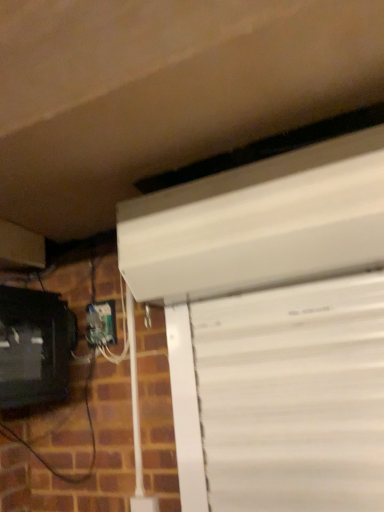
You are a GUI agent. You are given a task and a screenshot of the screen. Output one action in this format:
    pyautogui.click(x=<x>, y=<y>)
    Task: Click on the matte black monitor at lower left
    
    Given the screenshot: What is the action you would take?
    pyautogui.click(x=34, y=347)

What is the approximate height of matte black monitor at lower left?

matte black monitor at lower left is 37.65 centimeters tall.

The width and height of the screenshot is (384, 512). Describe the element at coordinates (34, 347) in the screenshot. I see `matte black monitor at lower left` at that location.

What do you see at coordinates (101, 324) in the screenshot? I see `white plastic electric outlet at lower left` at bounding box center [101, 324].

You are a GUI agent. You are given a task and a screenshot of the screen. Output one action in this format:
    pyautogui.click(x=<x>, y=<y>)
    Task: Click on the white plastic electric outlet at lower left
    
    Given the screenshot: What is the action you would take?
    pyautogui.click(x=101, y=324)

Locate an element on the screen. The width and height of the screenshot is (384, 512). matte black monitor at lower left is located at coordinates (34, 347).

Which object is positioned more to the left, white plastic electric outlet at lower left or matte black monitor at lower left?

matte black monitor at lower left is more to the left.

Is white plastic electric outlet at lower left positioned behind matte black monitor at lower left?

Yes, it is.

Considering the positions of point (87, 323) and point (35, 342), is point (87, 323) closer or farther from the camera than point (35, 342)?

Point (87, 323) is closer to the camera than point (35, 342).

Consider the image. From the image's perspective, who appears lower, white plastic electric outlet at lower left or matte black monitor at lower left?

matte black monitor at lower left appears lower in the image.

From a real-world perspective, is white plastic electric outlet at lower left positioned over matte black monitor at lower left based on gravity?

Yes, from a real-world perspective, white plastic electric outlet at lower left is over matte black monitor at lower left

Based on the photo, considering the relative sizes of white plastic electric outlet at lower left and matte black monitor at lower left in the image provided, is white plastic electric outlet at lower left thinner than matte black monitor at lower left?

Yes, white plastic electric outlet at lower left is thinner than matte black monitor at lower left.

Does white plastic electric outlet at lower left have a greater height compared to matte black monitor at lower left?

No, white plastic electric outlet at lower left is not taller than matte black monitor at lower left.

Which of these two, white plastic electric outlet at lower left or matte black monitor at lower left, is bigger?

Bigger between the two is matte black monitor at lower left.

Is white plastic electric outlet at lower left outside of matte black monitor at lower left?

Yes, white plastic electric outlet at lower left is not within matte black monitor at lower left.

Would you consider white plastic electric outlet at lower left to be distant from matte black monitor at lower left?

Actually, white plastic electric outlet at lower left and matte black monitor at lower left are a little close together.

Could you tell me if white plastic electric outlet at lower left is turned towards matte black monitor at lower left?

Yes, white plastic electric outlet at lower left is turned towards matte black monitor at lower left.

In the scene shown: Could you measure the distance between white plastic electric outlet at lower left and matte black monitor at lower left?

white plastic electric outlet at lower left is 8.93 inches away from matte black monitor at lower left.

Image resolution: width=384 pixels, height=512 pixels. What are the coordinates of `electric outlet above the matte black monitor at lower left (from the image's perspective)` in the screenshot? It's located at (101, 324).

Considering the relative positions of matte black monitor at lower left and white plastic electric outlet at lower left in the image provided, is matte black monitor at lower left to the left or to the right of white plastic electric outlet at lower left?

Clearly, matte black monitor at lower left is on the left of white plastic electric outlet at lower left in the image.

Who is more distant, matte black monitor at lower left or white plastic electric outlet at lower left?

white plastic electric outlet at lower left is more distant.

Is point (52, 379) more distant than point (113, 309)?

Yes, it is behind point (113, 309).

From the image's perspective, which is below, matte black monitor at lower left or white plastic electric outlet at lower left?

matte black monitor at lower left, from the image's perspective.

From a real-world perspective, is matte black monitor at lower left over white plastic electric outlet at lower left?

No, from a real-world perspective, matte black monitor at lower left is not above white plastic electric outlet at lower left.

Which object is wider, matte black monitor at lower left or white plastic electric outlet at lower left?

Wider between the two is matte black monitor at lower left.

Considering the sizes of matte black monitor at lower left and white plastic electric outlet at lower left in the image, is matte black monitor at lower left taller or shorter than white plastic electric outlet at lower left?

Considering their sizes, matte black monitor at lower left has more height than white plastic electric outlet at lower left.

Which of these two, matte black monitor at lower left or white plastic electric outlet at lower left, is bigger?

Bigger between the two is matte black monitor at lower left.

Is matte black monitor at lower left positioned beyond the bounds of white plastic electric outlet at lower left?

Yes, matte black monitor at lower left is not within white plastic electric outlet at lower left.

From the picture: Is matte black monitor at lower left next to white plastic electric outlet at lower left and touching it?

No, matte black monitor at lower left is not making contact with white plastic electric outlet at lower left.

Could you tell me if matte black monitor at lower left is turned towards white plastic electric outlet at lower left?

No, matte black monitor at lower left is not aimed at white plastic electric outlet at lower left.

At what (x,y) coordinates should I click in order to perform the action: click on electric outlet on the right of matte black monitor at lower left. Please return your answer as a coordinate pair (x, y). Image resolution: width=384 pixels, height=512 pixels. Looking at the image, I should click on (101, 324).

The image size is (384, 512). Identify the location of electric outlet on the right of matte black monitor at lower left. (101, 324).

Where is `computer monitor in front of the white plastic electric outlet at lower left`? computer monitor in front of the white plastic electric outlet at lower left is located at coordinates (34, 347).